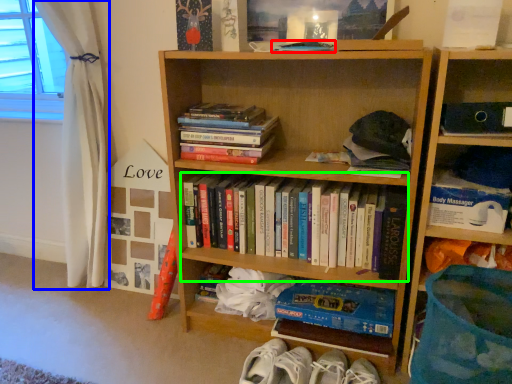
Question: Which object is the farthest from book (highlighted by a red box)? Choose among these: curtain (highlighted by a blue box) or book (highlighted by a green box).

Choices:
 (A) curtain
 (B) book

Answer: (A)